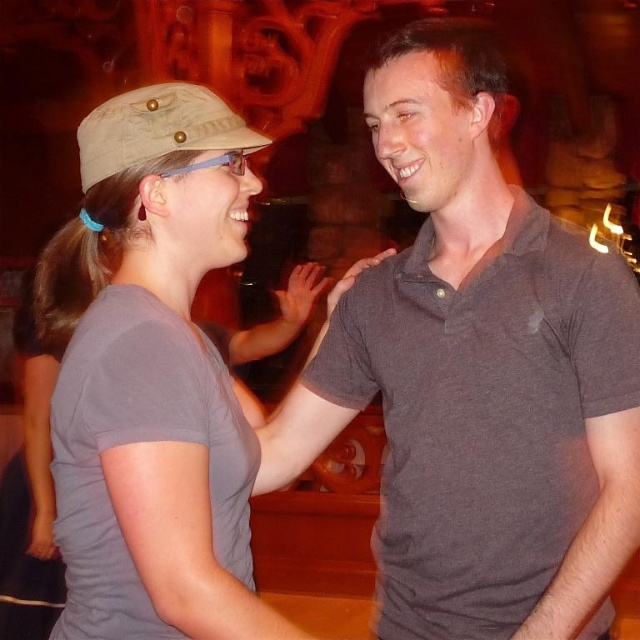
You are standing 10 feet away from the image and want to touch the point at coordinates point (154, 298). Can you reach it without moving closer?

The distance of point (154, 298) from viewer is 5.98 feet, so you can reach it without moving closer since you are currently 10 feet away.

You are a photographer setting up a shoot and want to ensure proper framing. In the image, you see the gray cotton polo shirt at center and the tan canvas baseball hat at left. Which object should you focus on first if you need to adjust the lighting for the one that is positioned to the left?

The tan canvas baseball hat at left should be focused on first because the gray cotton polo shirt at center is to the right of it, making the hat the leftmost object.